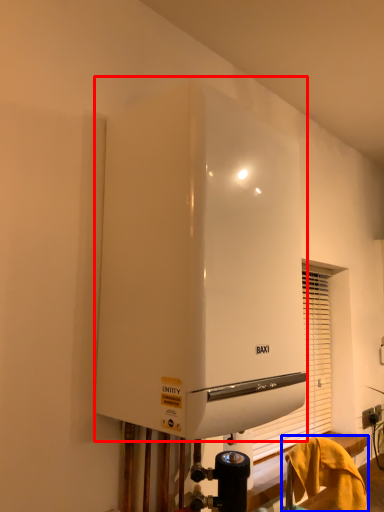
Question: Which of the following is the farthest to the observer, home appliance (highlighted by a red box) or furniture (highlighted by a blue box)?

Choices:
 (A) home appliance
 (B) furniture

Answer: (B)